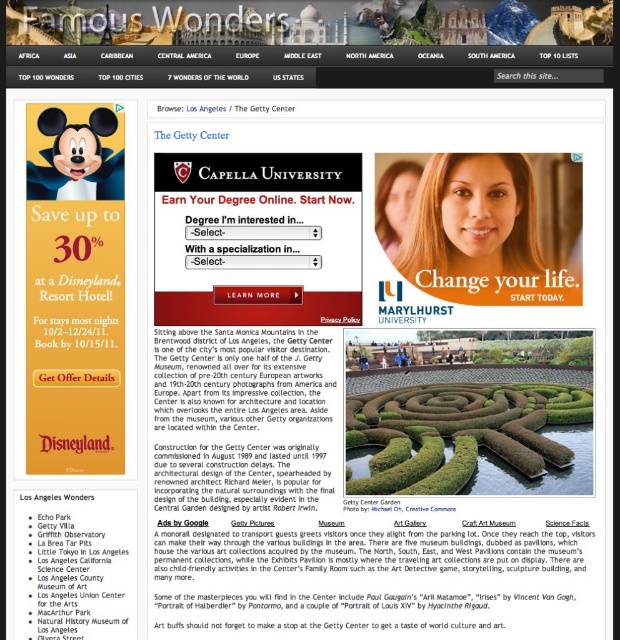
Consider the image. You are a web developer analyzing the layout of this webpage. You notice a point at coordinates (536, 349). Based on the scene description, which object does this point correspond to?

The point at coordinates (536, 349) corresponds to the green leafy hedge at center.

You are looking at a webpage about the Getty Center. There is a smooth skin face at center and a green leafy hedge at center. Which object takes up more space on the page?

The green leafy hedge at center takes up more space on the page because it is larger than the smooth skin face at center.

You are looking at the webpage about the Getty Center. There is a smooth skin face at center and a green leafy hedge at center. Which object is closer to you?

The smooth skin face at center is closer because it is positioned over the green leafy hedge at center.